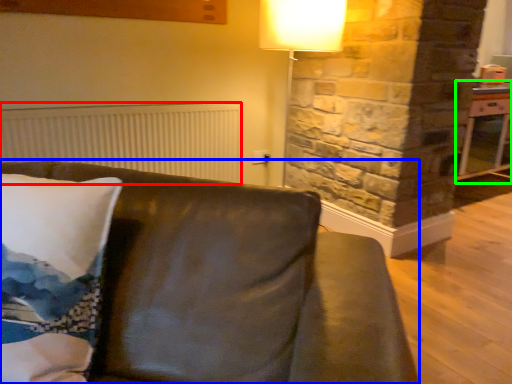
Question: Which object is the farthest from radiator (highlighted by a red box)? Choose among these: studio couch (highlighted by a blue box) or table (highlighted by a green box).

Choices:
 (A) studio couch
 (B) table

Answer: (B)